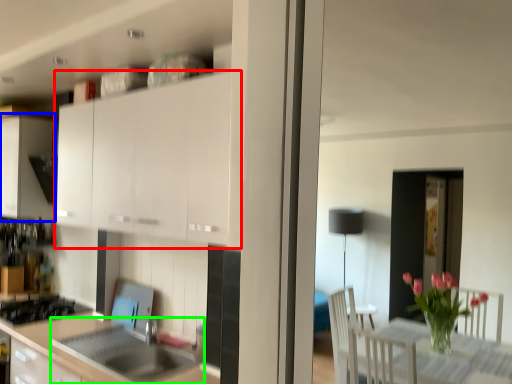
Question: Which is farther away from cabinetry (highlighted by a red box)? cabinetry (highlighted by a blue box) or sink (highlighted by a green box)?

Choices:
 (A) cabinetry
 (B) sink

Answer: (A)